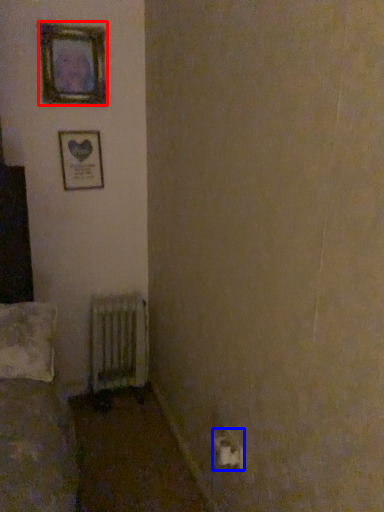
Question: Which object appears farthest to the camera in this image, picture frame (highlighted by a red box) or electric outlet (highlighted by a blue box)?

Choices:
 (A) picture frame
 (B) electric outlet

Answer: (A)